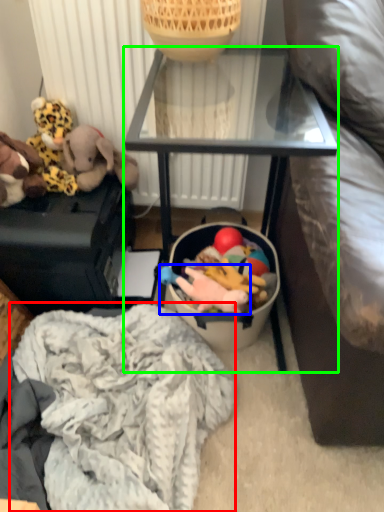
Question: Considering the real-world distances, which object is closest to clothing (highlighted by a red box)? toy (highlighted by a blue box) or furniture (highlighted by a green box).

Choices:
 (A) toy
 (B) furniture

Answer: (A)